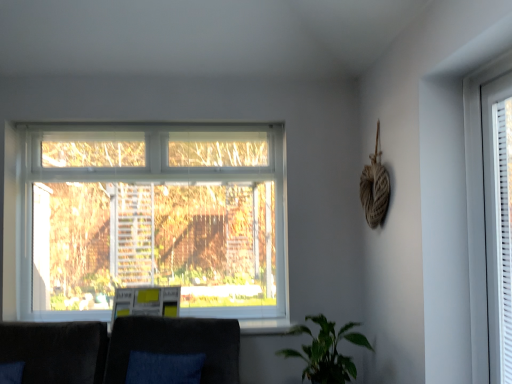
Question: Considering the relative sizes of green matte plant at lower right and velvet dark gray couch at lower center in the image provided, is green matte plant at lower right bigger than velvet dark gray couch at lower center?

Choices:
 (A) yes
 (B) no

Answer: (B)

Question: Is green matte plant at lower right thinner than velvet dark gray couch at lower center?

Choices:
 (A) no
 (B) yes

Answer: (B)

Question: Is green matte plant at lower right positioned behind velvet dark gray couch at lower center?

Choices:
 (A) yes
 (B) no

Answer: (A)

Question: Can you confirm if green matte plant at lower right is wider than velvet dark gray couch at lower center?

Choices:
 (A) no
 (B) yes

Answer: (A)

Question: From a real-world perspective, is green matte plant at lower right on top of velvet dark gray couch at lower center?

Choices:
 (A) yes
 (B) no

Answer: (A)

Question: Visually, is velvet dark gray couch at lower center positioned to the left or to the right of green matte plant at lower right?

Choices:
 (A) right
 (B) left

Answer: (B)

Question: Considering the positions of velvet dark gray couch at lower center and green matte plant at lower right in the image, is velvet dark gray couch at lower center taller or shorter than green matte plant at lower right?

Choices:
 (A) tall
 (B) short

Answer: (A)

Question: Relative to green matte plant at lower right, is velvet dark gray couch at lower center in front or behind?

Choices:
 (A) front
 (B) behind

Answer: (A)

Question: Which is correct: velvet dark gray couch at lower center is inside green matte plant at lower right, or outside of it?

Choices:
 (A) inside
 (B) outside

Answer: (B)

Question: Is green matte plant at lower right inside the boundaries of velvet dark gray couch at lower center, or outside?

Choices:
 (A) inside
 (B) outside

Answer: (B)

Question: Considering their positions, is green matte plant at lower right located in front of or behind velvet dark gray couch at lower center?

Choices:
 (A) behind
 (B) front

Answer: (A)

Question: In terms of width, does green matte plant at lower right look wider or thinner when compared to velvet dark gray couch at lower center?

Choices:
 (A) wide
 (B) thin

Answer: (B)

Question: From a real-world perspective, is green matte plant at lower right physically located above or below velvet dark gray couch at lower center?

Choices:
 (A) above
 (B) below

Answer: (A)

Question: From the image's perspective, relative to green matte plant at lower right, is white plastic window at right above or below?

Choices:
 (A) below
 (B) above

Answer: (B)

Question: From a real-world perspective, relative to green matte plant at lower right, is white plastic window at right vertically above or below?

Choices:
 (A) above
 (B) below

Answer: (A)